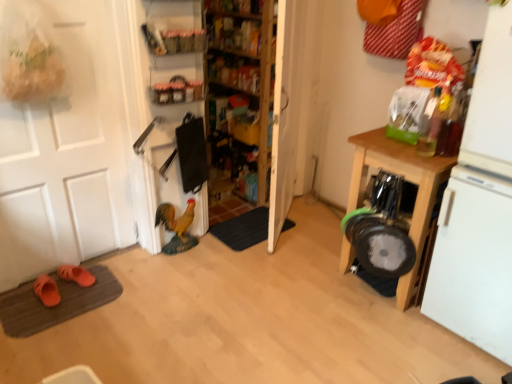
Image resolution: width=512 pixels, height=384 pixels. I want to click on vacant space to the left of wooden cutting board at right, so click(310, 277).